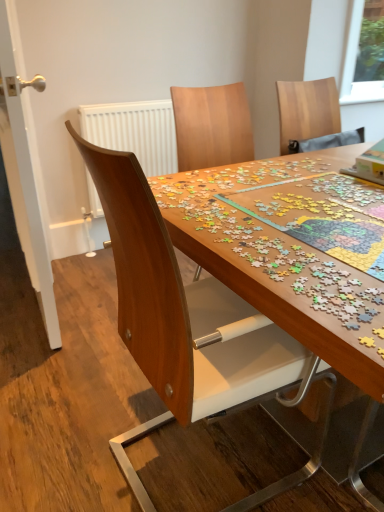
The image size is (384, 512). Find the location of `vacant region to the left of wooden chair at center`. vacant region to the left of wooden chair at center is located at coordinates click(70, 422).